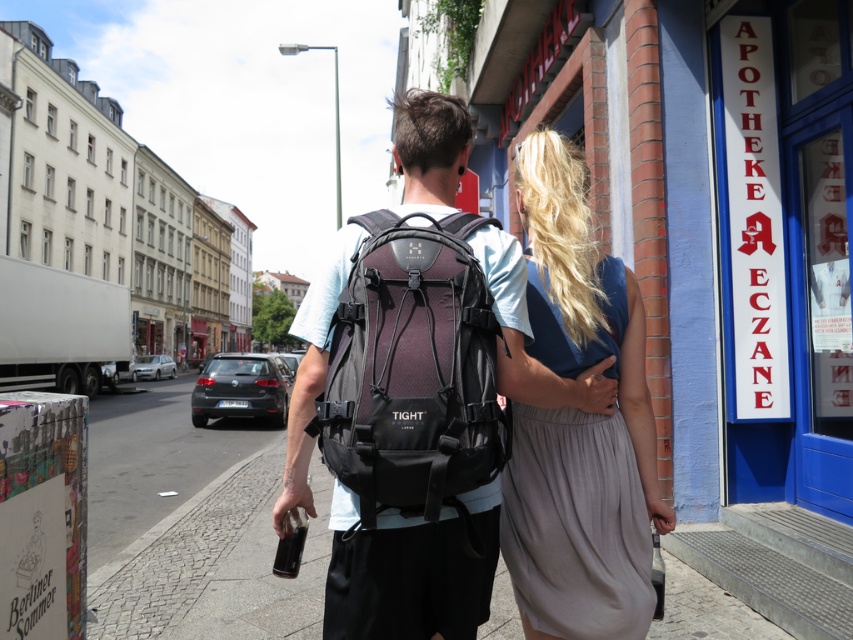
Question: Does light gray fabric dress at center appear on the left side of matte black backpack at center?

Choices:
 (A) yes
 (B) no

Answer: (B)

Question: Based on their relative distances, which object is nearer to the matte purple fabric backpack at center?

Choices:
 (A) matte black backpack at center
 (B) cobblestone pavement at center
 (C) light gray fabric dress at center

Answer: (A)

Question: Which of the following is the closest to the observer?

Choices:
 (A) (643, 515)
 (B) (210, 608)
 (C) (462, 184)
 (D) (367, 292)

Answer: (D)

Question: Does light gray fabric dress at center appear under matte black backpack at center?

Choices:
 (A) no
 (B) yes

Answer: (B)

Question: Which point is closer to the camera?

Choices:
 (A) (549, 637)
 (B) (627, 419)
 (C) (454, 291)
 (D) (187, 522)

Answer: (C)

Question: Can you confirm if cobblestone pavement at center is positioned to the left of matte black backpack at center?

Choices:
 (A) yes
 (B) no

Answer: (A)